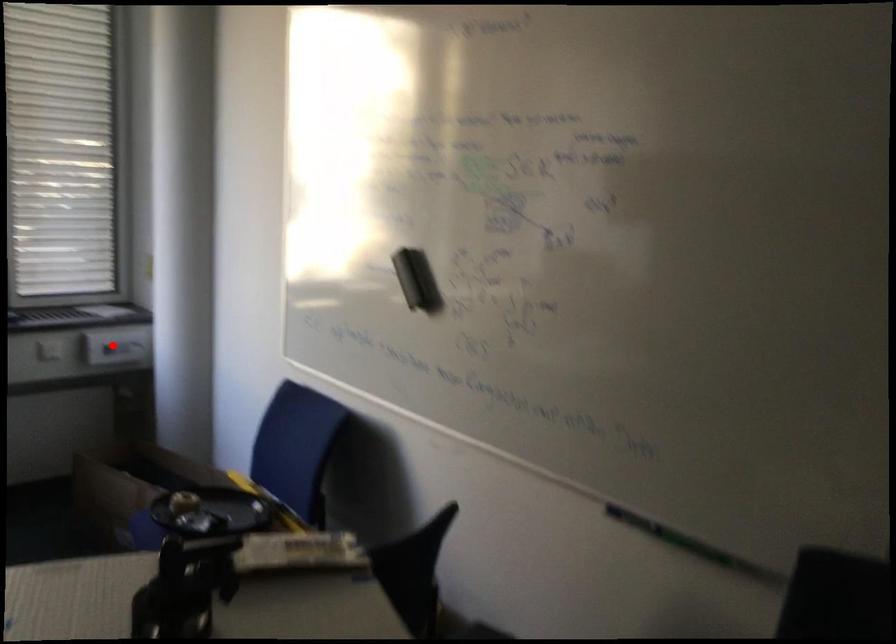
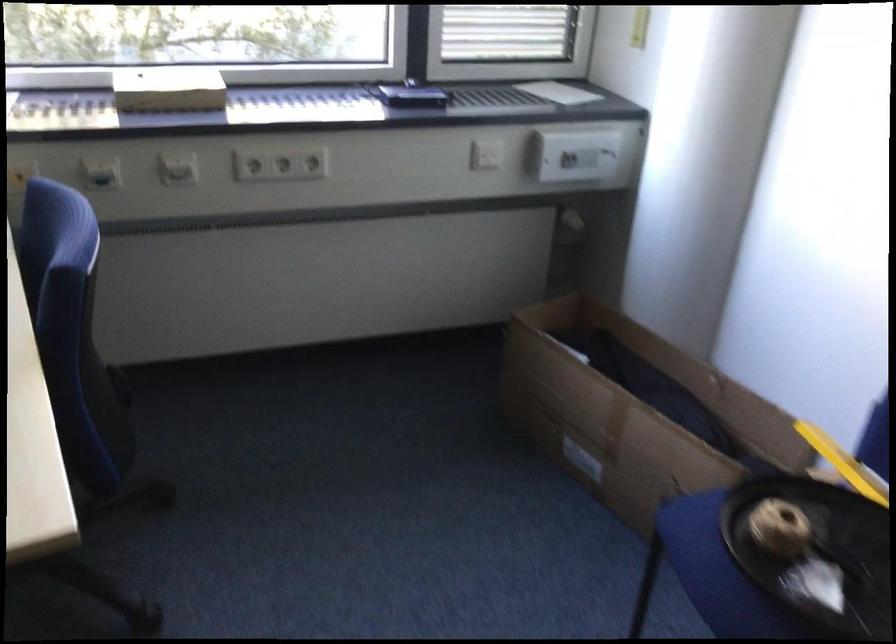
Question: A red point is marked in image1. In image2, is the corresponding 3D point closer to the camera or farther? Reply with the corresponding letter.

Choices:
 (A) The corresponding 3D point is closer.
 (B) The corresponding 3D point is farther.

Answer: (A)